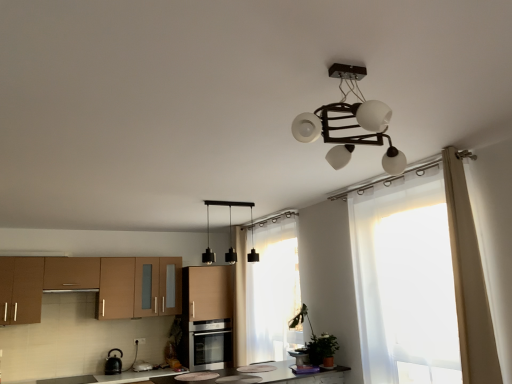
Describe the element at coordinates (298, 357) in the screenshot. I see `matte black pot at center, acting as the 1th appliance starting from the right` at that location.

Locate an element on the screen. sheer white curtain at center, marked as the first curtain in a back-to-front arrangement is located at coordinates (273, 293).

I want to click on translucent white curtain at right, so click(x=407, y=282).

Identify the location of matte wood cabinet at center, the 2th cabinetry positioned from the left. This screenshot has width=512, height=384. (206, 293).

Find the location of `black glossy kettle at lower left, the 1th appliance when ordered from back to front`. black glossy kettle at lower left, the 1th appliance when ordered from back to front is located at coordinates (113, 362).

At what (x,y) coordinates should I click in order to perform the action: click on matte black pot at center, the 1th appliance positioned from the top. Please return your answer as a coordinate pair (x, y). Looking at the image, I should click on (298, 357).

Is satin silver oven at center next to brown matte cabinet at left, which appears as the 1th cabinetry when viewed from the left, and touching it?

No, satin silver oven at center is not next to brown matte cabinet at left, which appears as the 1th cabinetry when viewed from the left.

Who is smaller, satin silver oven at center or brown matte cabinet at left, the second cabinetry when ordered from right to left?

With smaller size is satin silver oven at center.

From the image's perspective, between satin silver oven at center and brown matte cabinet at left, which appears as the 1th cabinetry when viewed from the left, which one is located above?

From the image's view, brown matte cabinet at left, which appears as the 1th cabinetry when viewed from the left, is above.

From the image's perspective, between matte wood cabinet at center, the 2th cabinetry positioned from the left, and black matte pendant lights at center, who is located below?

From the image's view, matte wood cabinet at center, the 2th cabinetry positioned from the left, is below.

Which object is further away from the camera taking this photo, matte wood cabinet at center, which is counted as the 1th cabinetry, starting from the right, or black matte pendant lights at center?

matte wood cabinet at center, which is counted as the 1th cabinetry, starting from the right, is more distant.

Which point is more distant from viewer, (222,286) or (210,255)?

Positioned behind is point (210,255).

How different are the orientations of green matte plant at lower right and matte wood cabinet at center, which is counted as the 1th cabinetry, starting from the right, in degrees?

green matte plant at lower right and matte wood cabinet at center, which is counted as the 1th cabinetry, starting from the right, are facing 90.2 degrees away from each other.

Considering the sizes of objects green matte plant at lower right and matte wood cabinet at center, which is counted as the 1th cabinetry, starting from the right, in the image provided, who is shorter, green matte plant at lower right or matte wood cabinet at center, which is counted as the 1th cabinetry, starting from the right,?

With less height is green matte plant at lower right.

Is green matte plant at lower right far away from matte wood cabinet at center, the 2th cabinetry positioned from the left?

Yes, green matte plant at lower right and matte wood cabinet at center, the 2th cabinetry positioned from the left, are quite far apart.

From the image's perspective, is white sheer curtain at right, placed as the 1th curtain when sorted from front to back, on matte black pot at center, acting as the 1th appliance starting from the right?

Yes.

Is white sheer curtain at right, marked as the 2th curtain in a left-to-right arrangement, aimed at matte black pot at center, the 2th appliance in the bottom-to-top sequence?

No, white sheer curtain at right, marked as the 2th curtain in a left-to-right arrangement, is not oriented towards matte black pot at center, the 2th appliance in the bottom-to-top sequence.

From a real-world perspective, which object rests below the other?

matte black pot at center, the 1th appliance from the front, from a real-world perspective.

Considering the points (230, 323) and (192, 310), which point is behind, point (230, 323) or point (192, 310)?

The point (192, 310) is behind.

Can you confirm if satin silver oven at center is taller than matte wood cabinet at center, the 2th cabinetry positioned from the left?

Incorrect, the height of satin silver oven at center is not larger of that of matte wood cabinet at center, the 2th cabinetry positioned from the left.

Does satin silver oven at center come behind matte wood cabinet at center, the 2th cabinetry positioned from the left?

No, satin silver oven at center is in front of matte wood cabinet at center, the 2th cabinetry positioned from the left.

Which is more to the left, satin silver oven at center or matte wood cabinet at center, which is counted as the 1th cabinetry, starting from the right?

matte wood cabinet at center, which is counted as the 1th cabinetry, starting from the right, is more to the left.

From the image's perspective, is black matte pendant lights at center under green matte plant at lower right?

Incorrect, from the image's perspective, black matte pendant lights at center is higher than green matte plant at lower right.

Between point (231, 256) and point (320, 356), which one is positioned behind?

Positioned behind is point (231, 256).

From a real-world perspective, is black matte pendant lights at center positioned over green matte plant at lower right based on gravity?

Correct, in the physical world, black matte pendant lights at center is higher than green matte plant at lower right.

Considering the relative positions of black matte pendant lights at center and green matte plant at lower right in the image provided, is black matte pendant lights at center to the left or to the right of green matte plant at lower right?

Clearly, black matte pendant lights at center is on the left of green matte plant at lower right in the image.

Considering the sizes of objects white sheer curtain at right, the 1th curtain positioned from the right, and matte wood cabinet at center, the 2th cabinetry positioned from the left, in the image provided, who is bigger, white sheer curtain at right, the 1th curtain positioned from the right, or matte wood cabinet at center, the 2th cabinetry positioned from the left,?

matte wood cabinet at center, the 2th cabinetry positioned from the left.

Considering the relative positions of white sheer curtain at right, the 1th curtain positioned from the right, and matte wood cabinet at center, the 2th cabinetry positioned from the left, in the image provided, is white sheer curtain at right, the 1th curtain positioned from the right, to the left or to the right of matte wood cabinet at center, the 2th cabinetry positioned from the left,?

white sheer curtain at right, the 1th curtain positioned from the right, is to the right of matte wood cabinet at center, the 2th cabinetry positioned from the left.

Considering the positions of point (468, 359) and point (221, 281), is point (468, 359) closer or farther from the camera than point (221, 281)?

Clearly, point (468, 359) is closer to the camera than point (221, 281).

From the image's perspective, count 2nd cabinetrys upward from the satin silver oven at center and point to it. Please provide its 2D coordinates.

[(92, 285)]

Identify the location of cabinetry that is the 1st one when counting leftward from the black matte pendant lights at center. (206, 293).

Looking at this image, which object lies nearer to the anchor point satin silver oven at center, brown matte cabinet at left, the second cabinetry when ordered from right to left, or black matte pendant lights at center?

Based on the image, black matte pendant lights at center appears to be nearer to satin silver oven at center.

Estimate the real-world distances between objects in this image. Which object is closer to white sheer curtain at right, placed as the 1th curtain when sorted from front to back, translucent white curtain at right or brown matte cabinet at left, the second cabinetry when ordered from right to left?

translucent white curtain at right.

Which object lies further to the anchor point matte black pot at center, acting as the 2th appliance starting from the back, matte wood cabinet at center, which is counted as the 1th cabinetry, starting from the right, or black glossy kettle at lower left, the 1th appliance when ordered from back to front?

black glossy kettle at lower left, the 1th appliance when ordered from back to front, is positioned further to the anchor matte black pot at center, acting as the 2th appliance starting from the back.

Which object lies nearer to the anchor point black matte pendant lights at center, sheer white curtain at center, the second curtain from the right, or satin silver oven at center?

Among the two, satin silver oven at center is located nearer to black matte pendant lights at center.

Looking at the image, which one is located further to matte wood cabinet at center, which is counted as the 1th cabinetry, starting from the right, brown matte cabinet at left, which appears as the 1th cabinetry when viewed from the left, or green matte plant at lower right?

green matte plant at lower right lies further to matte wood cabinet at center, which is counted as the 1th cabinetry, starting from the right, than the other object.

Estimate the real-world distances between objects in this image. Which object is closer to sheer white curtain at center, marked as the first curtain in a back-to-front arrangement, green matte plant at lower right or brown matte cabinet at left, which appears as the 1th cabinetry when viewed from the left?

Among the two, green matte plant at lower right is located nearer to sheer white curtain at center, marked as the first curtain in a back-to-front arrangement.

From the image, which object appears to be nearer to satin silver oven at center, matte black pot at center, the 2th appliance in the bottom-to-top sequence, or brown matte cabinet at left, which appears as the 1th cabinetry when viewed from the left?

The object closer to satin silver oven at center is brown matte cabinet at left, which appears as the 1th cabinetry when viewed from the left.

When comparing their distances from matte wood cabinet at center, the 2th cabinetry positioned from the left, does white sheer curtain at right, placed as the 1th curtain when sorted from front to back, or black glossy kettle at lower left, marked as the first appliance in a bottom-to-top arrangement, seem further?

The object further to matte wood cabinet at center, the 2th cabinetry positioned from the left, is white sheer curtain at right, placed as the 1th curtain when sorted from front to back.

Where is `appliance situated between brown matte cabinet at left, which appears as the 1th cabinetry when viewed from the left, and black matte pendant lights at center from left to right`? Image resolution: width=512 pixels, height=384 pixels. appliance situated between brown matte cabinet at left, which appears as the 1th cabinetry when viewed from the left, and black matte pendant lights at center from left to right is located at coordinates (113, 362).

Locate an element on the screen. oven between brown matte cabinet at left, which appears as the 1th cabinetry when viewed from the left, and sheer white curtain at center, which is the second curtain from front to back, in the horizontal direction is located at coordinates (209, 344).

Locate an element on the screen. lamp positioned between white sheer curtain at right, marked as the 2th curtain in a left-to-right arrangement, and matte black pot at center, acting as the 2th appliance starting from the back, from near to far is located at coordinates (229, 231).

Where is `oven between black matte pendant lights at center and black glossy kettle at lower left, which is counted as the second appliance, starting from the top, in the up-down direction`? This screenshot has width=512, height=384. oven between black matte pendant lights at center and black glossy kettle at lower left, which is counted as the second appliance, starting from the top, in the up-down direction is located at coordinates (209, 344).